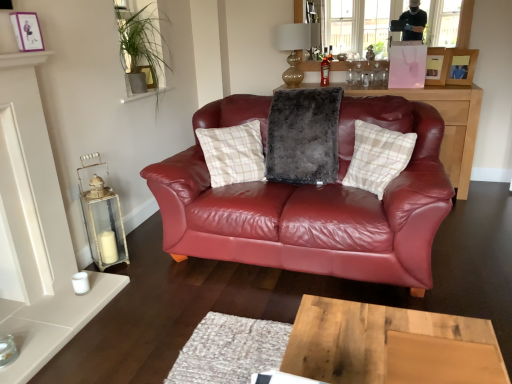
Question: In the image, is gold glass lampshade at upper center on the left side or the right side of white distressed wood lantern at left?

Choices:
 (A) left
 (B) right

Answer: (B)

Question: From the image's perspective, is gold glass lampshade at upper center above or below white distressed wood lantern at left?

Choices:
 (A) below
 (B) above

Answer: (B)

Question: Which object is positioned closest to the matte black cabinet at center?

Choices:
 (A) transparent glass window screen at upper center
 (B) wooden desk at center
 (C) fuzzy gray pillow at center, which appears as the 1th pillow when viewed from the left
 (D) matte purple picture frame at upper left, the first picture frame from the front
 (E) wooden picture frame at upper right, placed as the second picture frame when sorted from back to front

Answer: (E)

Question: Which object is positioned closest to the gold glass lampshade at upper center?

Choices:
 (A) transparent glass window screen at upper center
 (B) white distressed wood lantern at left
 (C) translucent glass bottle at center
 (D) fuzzy gray pillow at center, arranged as the second pillow when viewed from the right
 (E) wooden picture frame at upper right, the first picture frame in the right-to-left sequence

Answer: (C)